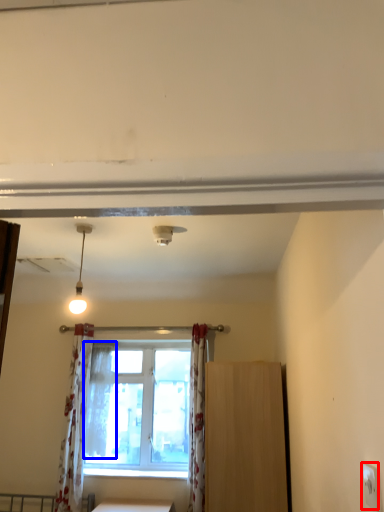
Question: Which point is further to the camera, electric outlet (highlighted by a red box) or shower curtain (highlighted by a blue box)?

Choices:
 (A) electric outlet
 (B) shower curtain

Answer: (B)